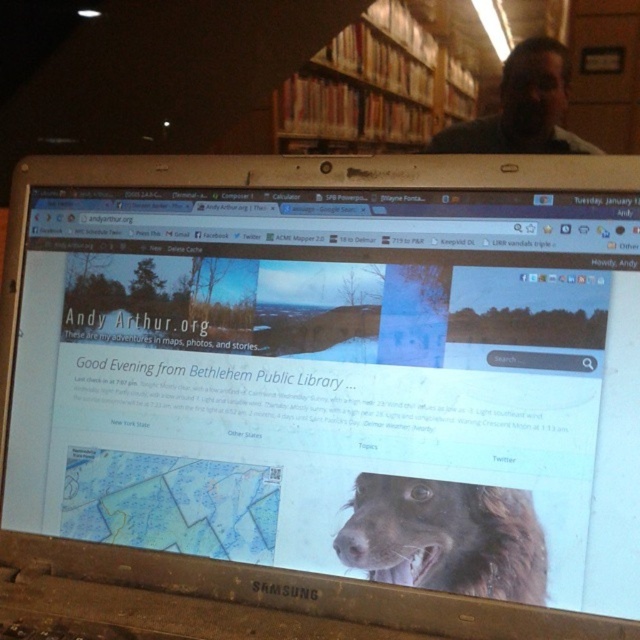
Who is positioned more to the left, wooden bookshelf at upper center or matte black laptop at upper center?

wooden bookshelf at upper center

Is wooden bookshelf at upper center wider than matte black laptop at upper center?

Correct, the width of wooden bookshelf at upper center exceeds that of matte black laptop at upper center.

Is point (339, 108) in front of point (456, 141)?

No, (339, 108) is behind (456, 141).

This screenshot has width=640, height=640. I want to click on wooden bookshelf at upper center, so click(372, 88).

Does brown furry dog at center lie in front of matte black laptop at upper center?

Yes, brown furry dog at center is closer to the viewer.

Between brown furry dog at center and matte black laptop at upper center, which one has less height?

brown furry dog at center

Is point (524, 588) positioned before point (508, 125)?

Yes, point (524, 588) is closer to viewer.

At what (x,y) coordinates should I click in order to perform the action: click on brown furry dog at center. Please return your answer as a coordinate pair (x, y). The width and height of the screenshot is (640, 640). Looking at the image, I should click on (445, 538).

Looking at this image, can you confirm if wooden bookshelf at upper center is bigger than brown furry dog at center?

Yes.

Which is more to the left, wooden bookshelf at upper center or brown furry dog at center?

Positioned to the left is wooden bookshelf at upper center.

Measure the distance between point (x=406, y=51) and camera.

Point (x=406, y=51) and camera are 1.24 meters apart from each other.

I want to click on wooden bookshelf at upper center, so click(x=372, y=88).